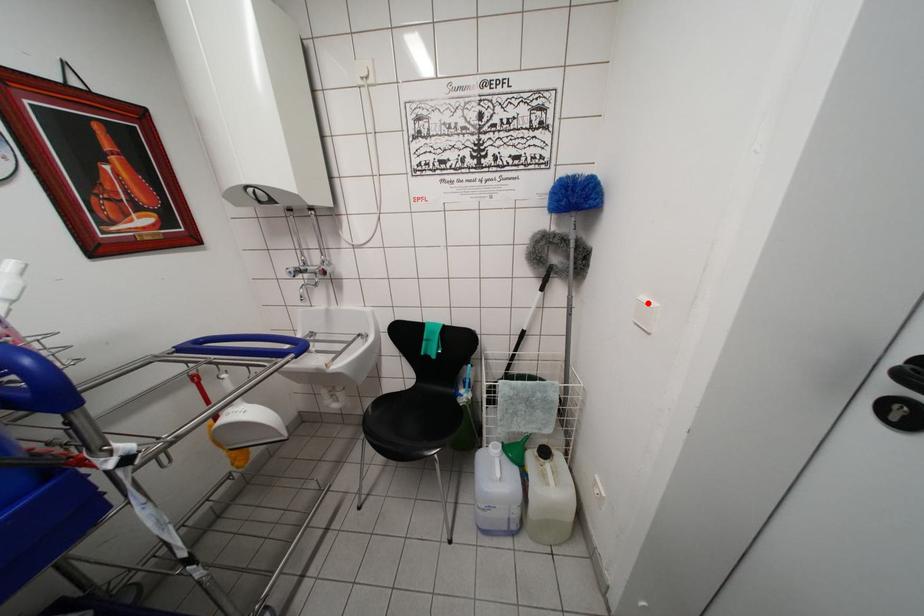
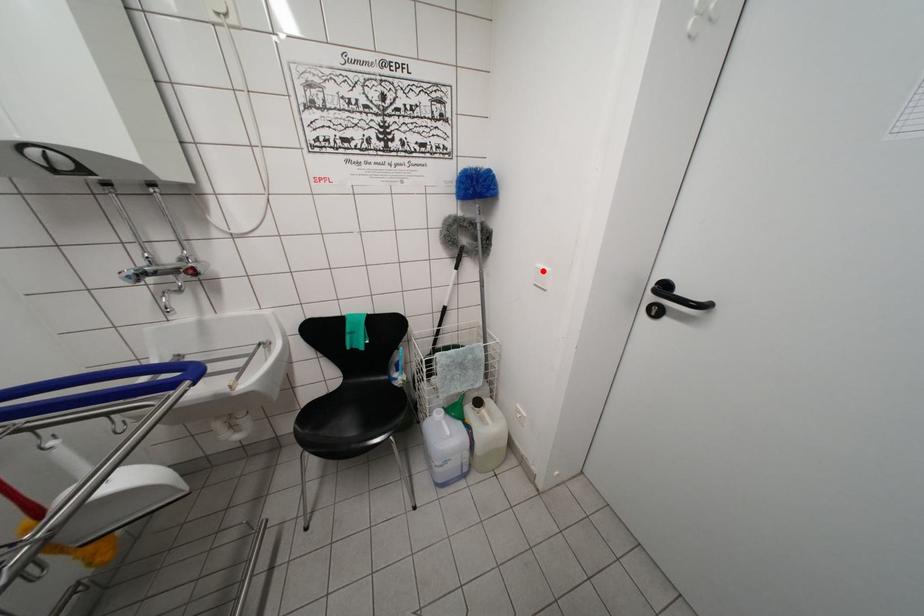
I am providing you with two images of the same scene from different viewpoints. A red point is marked on the first image and another point is marked on the second image. Is the marked point in image1 the same physical position as the marked point in image2?

Yes